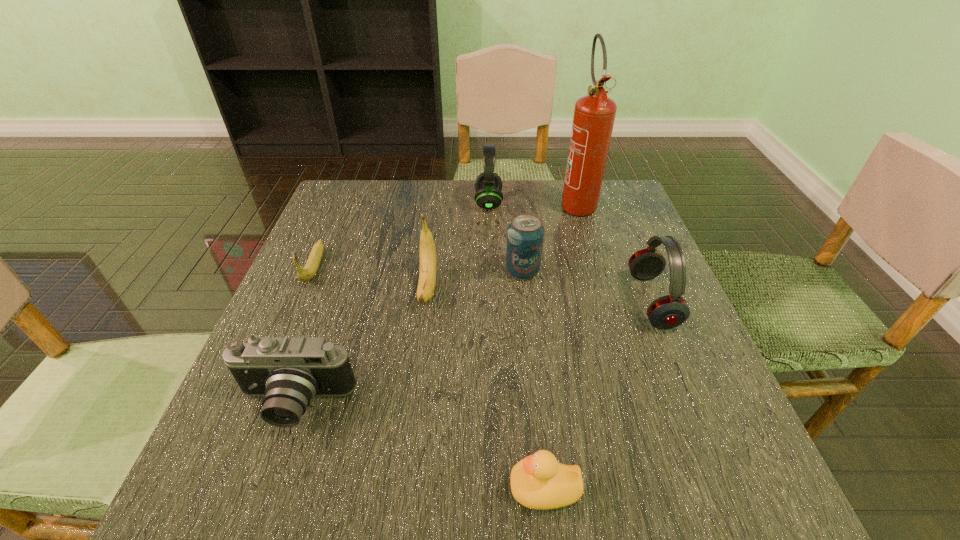
Where is `free space between the tallest object and the taller banana`? This screenshot has width=960, height=540. free space between the tallest object and the taller banana is located at coordinates (503, 245).

Identify the location of free space between the seventh farthest object and the headset. Image resolution: width=960 pixels, height=540 pixels. (392, 303).

The image size is (960, 540). I want to click on vacant area that lies between the pop soda and the duck, so click(534, 380).

Image resolution: width=960 pixels, height=540 pixels. Identify the location of blank region between the seventh farthest object and the third object from left to right. click(361, 346).

Find the location of a particular element. The image size is (960, 540). free space between the left banana and the second object from right to left is located at coordinates (445, 235).

The width and height of the screenshot is (960, 540). What are the coordinates of `vacant space in between the third object from left to right and the pop soda` in the screenshot? It's located at (475, 279).

At what (x,y) coordinates should I click in order to perform the action: click on free point between the rightmost object and the headset. Please return your answer as a coordinate pair (x, y). Looking at the image, I should click on 570,252.

Find the location of a particular element. The image size is (960, 540). unoccupied position between the shorter banana and the camera is located at coordinates (304, 336).

Identify the location of free spot between the shorter banana and the seventh object from left to right. (445, 235).

Locate an element on the screen. This screenshot has width=960, height=540. the closest object to the headset is located at coordinates (594, 114).